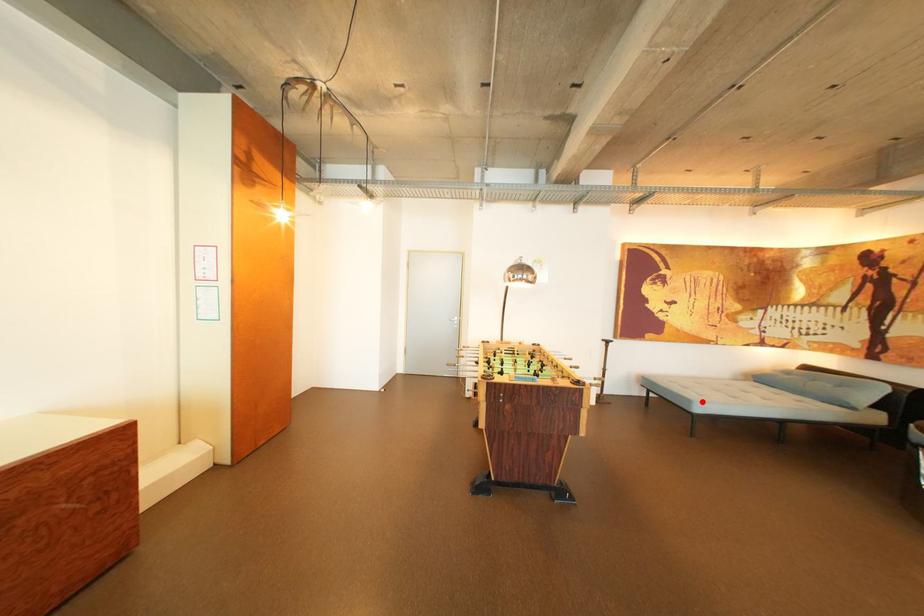
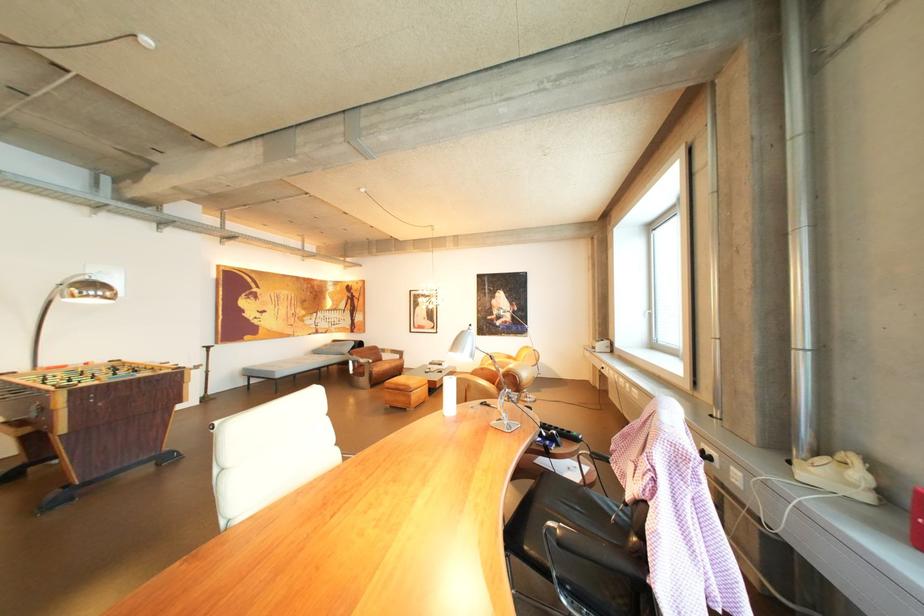
The point at the highlighted location is marked in the first image. Where is the corresponding point in the second image?

(286, 373)